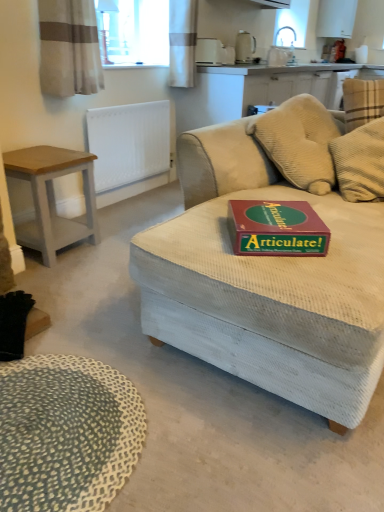
Question: Is white textured curtain at upper center, arranged as the second curtain when viewed from the left, wider or thinner than light gray wood side table at left?

Choices:
 (A) thin
 (B) wide

Answer: (A)

Question: From a real-world perspective, is white textured curtain at upper center, which is counted as the 1th curtain, starting from the right, above or below light gray wood side table at left?

Choices:
 (A) below
 (B) above

Answer: (B)

Question: Which object is the farthest from the maroon cardboard game box at center?

Choices:
 (A) textured beige couch at center
 (B) white plastic toaster at upper center, which ranks as the first appliance in left-to-right order
 (C) beige fabric curtain at upper left, which is counted as the second curtain, starting from the right
 (D) white textured radiator at upper left
 (E) matte beige kettle at upper center, which is the second appliance from front to back

Answer: (E)

Question: Which is farther from the white plastic toaster at upper center, which ranks as the first appliance in left-to-right order?

Choices:
 (A) light gray wood side table at left
 (B) beige fabric curtain at upper left, positioned as the 1th curtain in front-to-back order
 (C) maroon cardboard game box at center
 (D) white textured radiator at upper left
 (E) textured beige mat at lower left

Answer: (E)